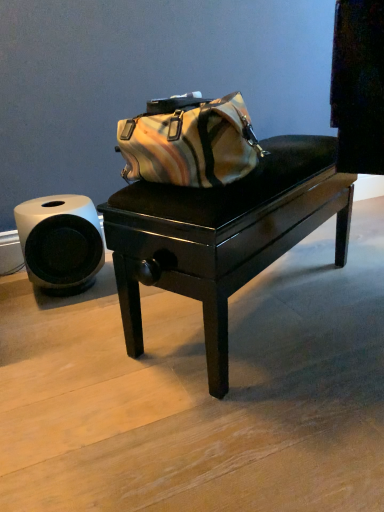
This screenshot has height=512, width=384. I want to click on vacant space that is to the left of white matte toilet paper at left, so click(13, 292).